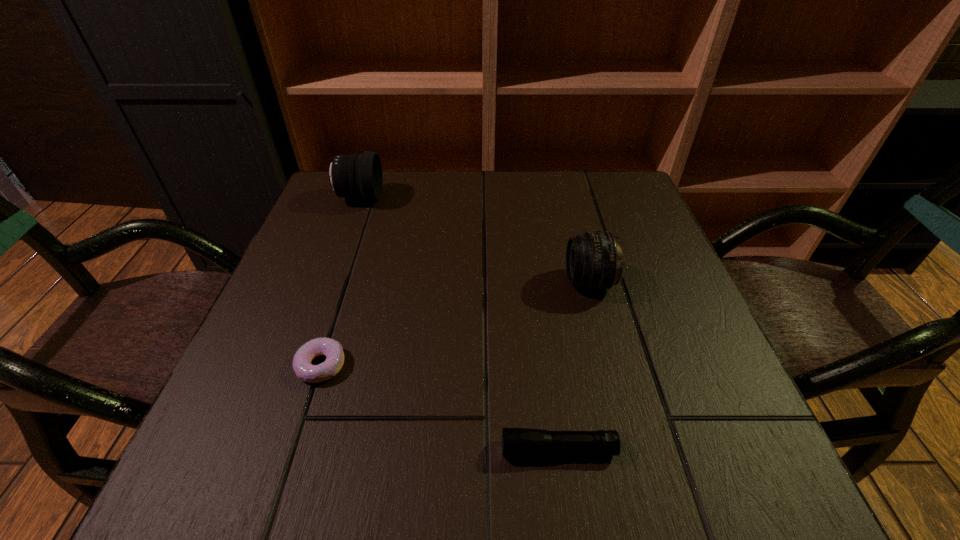
At what (x,y) coordinates should I click in order to perform the action: click on free space between the second farthest object and the shortest object. Please return your answer as a coordinate pair (x, y). The height and width of the screenshot is (540, 960). Looking at the image, I should click on (455, 323).

Identify the location of free space between the nearest object and the nearer telephoto lens. Image resolution: width=960 pixels, height=540 pixels. (573, 366).

Where is `free point between the second nearest object and the flashlight`? This screenshot has width=960, height=540. free point between the second nearest object and the flashlight is located at coordinates (440, 407).

Locate an element on the screen. This screenshot has height=540, width=960. free area in between the farthest object and the nearest object is located at coordinates (459, 323).

The image size is (960, 540). In order to click on free space between the farther telephoto lens and the doughnut in this screenshot , I will do `click(341, 281)`.

Where is `free spot between the nearer telephoto lens and the farther telephoto lens`? The height and width of the screenshot is (540, 960). free spot between the nearer telephoto lens and the farther telephoto lens is located at coordinates click(474, 240).

Locate an element on the screen. free spot between the nearer telephoto lens and the farthest object is located at coordinates (474, 240).

I want to click on vacant space that is in between the farther telephoto lens and the second nearest object, so click(x=341, y=281).

At what (x,y) coordinates should I click in order to perform the action: click on object that stands as the second closest to the nearer telephoto lens. Please return your answer as a coordinate pair (x, y). Looking at the image, I should click on click(x=332, y=349).

Identify which object is located as the third nearest to the doughnut. Please provide its 2D coordinates. Your answer should be formatted as a tuple, i.e. [(x, y)], where the tuple contains the x and y coordinates of a point satisfying the conditions above.

[(594, 260)]